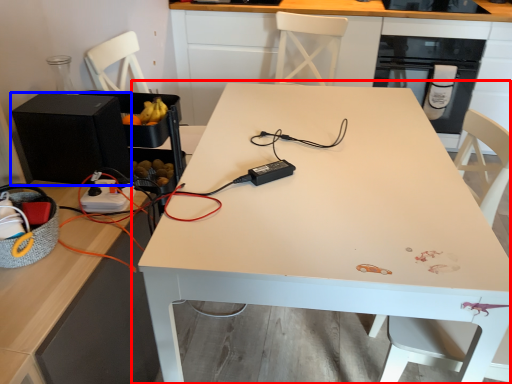
Question: Which of the following is the farthest to the observer, table (highlighted by a red box) or appliance (highlighted by a blue box)?

Choices:
 (A) table
 (B) appliance

Answer: (B)